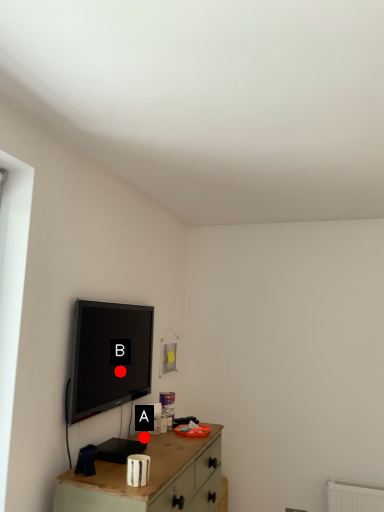
Question: Two points are circled on the image, labeled by A and B beside each circle. Which of the following is the farthest from the observer?

Choices:
 (A) A is further
 (B) B is further

Answer: (A)